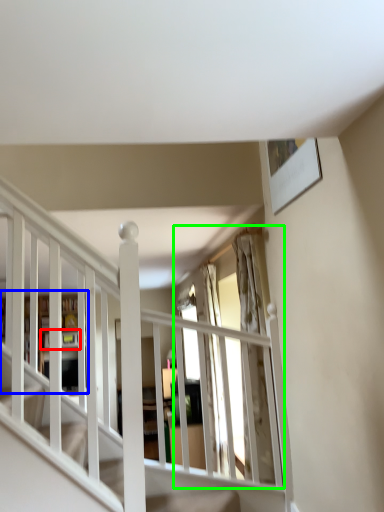
Question: Estimate the real-world distances between objects in this image. Which object is closer to shelf (highlighted by a red box), bookshelf (highlighted by a blue box) or window (highlighted by a green box)?

Choices:
 (A) bookshelf
 (B) window

Answer: (A)